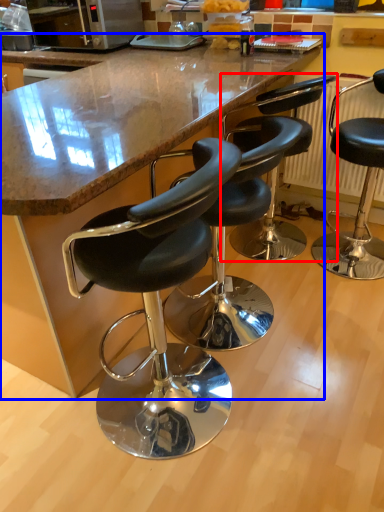
Question: Among these objects, which one is nearest to the camera, chair (highlighted by a red box) or counter (highlighted by a blue box)?

Choices:
 (A) chair
 (B) counter

Answer: (B)